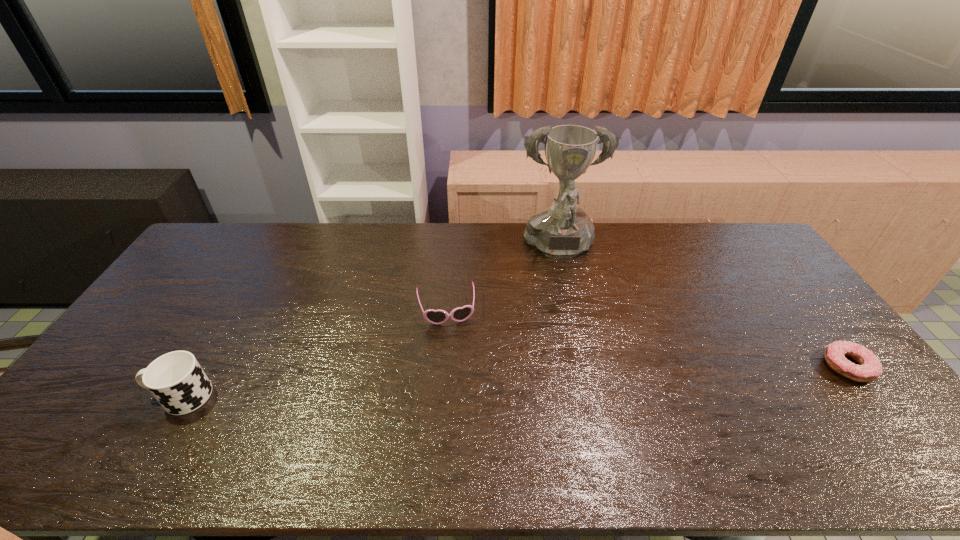
Locate an element on the screen. Image resolution: width=960 pixels, height=540 pixels. vacant space on the desktop that is between the cup and the shortest object and is positioned on the front-facing side of the second shortest object is located at coordinates (456, 384).

The image size is (960, 540). I want to click on vacant space on the desktop that is between the cup and the shortest object and is positioned on the side with emblem of the third object from left to right, so click(584, 378).